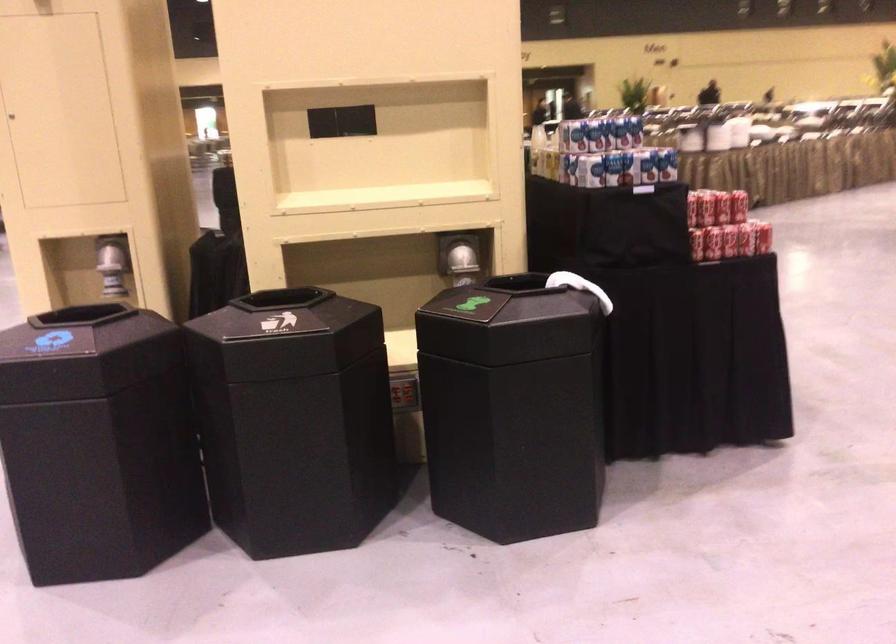
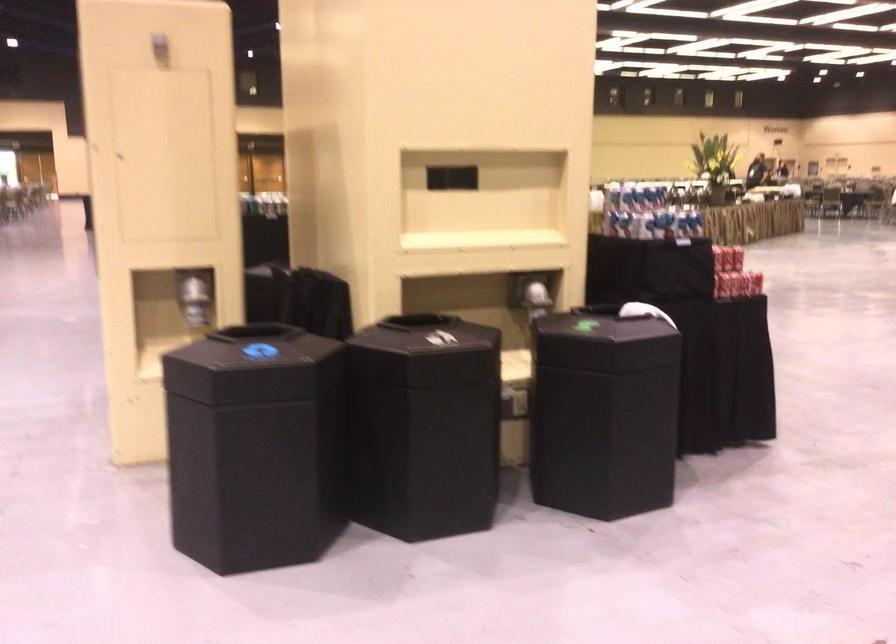
Where in the second image is the point corresponding to the point at 110,263 from the first image?

(194, 297)